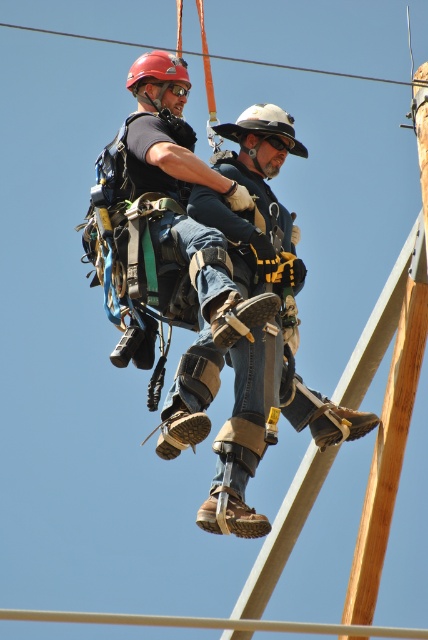
You are an inspector checking safety gear compliance in a high altitude work site. You observe two workers wearing helmets. The first worker has a matte red helmet at upper left, and the second has a white matte helmet at center. According to safety regulations, helmets must not exceed 20 cm in height to prevent interference with safety harnesses. Can you determine if either helmet violates this regulation?

The white matte helmet at center is taller than the matte red helmet at upper left. Since the regulation states helmets must not exceed 20 cm, we need to check both. If the taller white matte helmet at center is over 20 cm, it violates the rule. However, without specific measurements, we can only note that the white matte helmet at center is taller than the red one.

Looking at this image, based on the scene description, where is the white matte helmet at center located in the image?

The white matte helmet at center is located at point coordinates of 0.197 on the x axis and 0.614 on the y axis.

You are standing at the camera position and need to reach the point marked at coordinates point (214, 524). If you can move at a speed of 10 feet per minute, how many minutes will it take you to reach the point?

The point (214, 524) is 216.82 feet away from the camera. Moving at 10 feet per minute, it would take 21.682 minutes to reach the point.